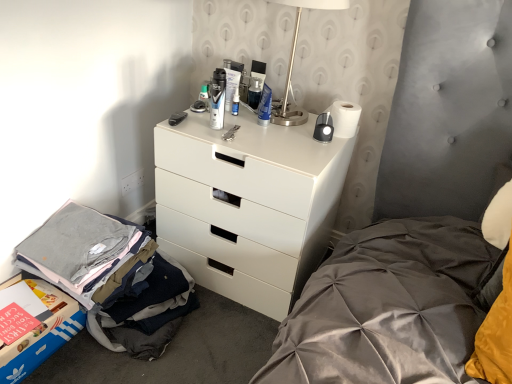
Locate an element on the screen. The width and height of the screenshot is (512, 384). vacant space that is to the left of matte black shaving cream can at center, marked as the second toiletry in a left-to-right arrangement is located at coordinates (189, 125).